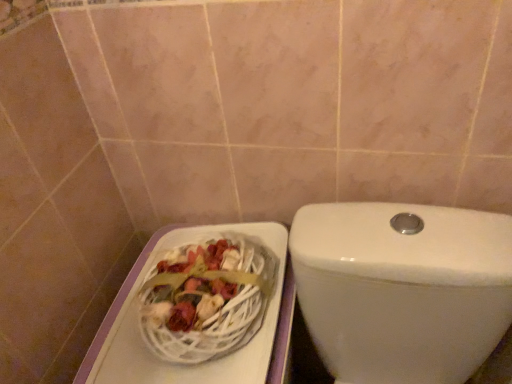
Identify the location of white glossy toilet at center. The image size is (512, 384). (402, 289).

Describe the element at coordinates (402, 289) in the screenshot. This screenshot has height=384, width=512. I see `white glossy toilet at center` at that location.

In order to click on white wicker basket at lower left in this screenshot , I will do `click(206, 298)`.

What do you see at coordinates (206, 298) in the screenshot? This screenshot has width=512, height=384. I see `white wicker basket at lower left` at bounding box center [206, 298].

Find the location of a particular element. This screenshot has width=512, height=384. white glossy toilet at center is located at coordinates (402, 289).

Which is more to the left, white glossy toilet at center or white wicker basket at lower left?

From the viewer's perspective, white wicker basket at lower left appears more on the left side.

In the image, is white glossy toilet at center positioned in front of or behind white wicker basket at lower left?

In the image, white glossy toilet at center appears in front of white wicker basket at lower left.

Is point (474, 370) positioned before point (244, 286)?

No.

From the image's perspective, between white glossy toilet at center and white wicker basket at lower left, who is located below?

white glossy toilet at center is shown below in the image.

From a real-world perspective, is white glossy toilet at center positioned over white wicker basket at lower left based on gravity?

No, from a real-world perspective, white glossy toilet at center is not on top of white wicker basket at lower left.

Is white glossy toilet at center wider than white wicker basket at lower left?

Correct, the width of white glossy toilet at center exceeds that of white wicker basket at lower left.

Considering the sizes of objects white glossy toilet at center and white wicker basket at lower left in the image provided, who is shorter, white glossy toilet at center or white wicker basket at lower left?

Standing shorter between the two is white wicker basket at lower left.

From the picture: Looking at the image, does white glossy toilet at center seem bigger or smaller compared to white wicker basket at lower left?

Clearly, white glossy toilet at center is larger in size than white wicker basket at lower left.

Is white glossy toilet at center positioned beyond the bounds of white wicker basket at lower left?

white glossy toilet at center lies outside white wicker basket at lower left's area.

Is the surface of white glossy toilet at center in direct contact with white wicker basket at lower left?

white glossy toilet at center and white wicker basket at lower left are not in contact.

Is white glossy toilet at center looking in the opposite direction of white wicker basket at lower left?

white glossy toilet at center is not turned away from white wicker basket at lower left.

What are the coordinates of `toilet on the right of white wicker basket at lower left` in the screenshot? It's located at (402, 289).

Is white wicker basket at lower left to the right of white glossy toilet at center from the viewer's perspective?

No, white wicker basket at lower left is not to the right of white glossy toilet at center.

Considering the relative positions of white wicker basket at lower left and white glossy toilet at center in the image provided, is white wicker basket at lower left behind white glossy toilet at center?

Yes, it is.

Is point (217, 244) in front of point (334, 218)?

That is False.

From the image's perspective, is white wicker basket at lower left on top of white glossy toilet at center?

Yes.

From a real-world perspective, is white wicker basket at lower left located higher than white glossy toilet at center?

Yes.

In terms of width, does white wicker basket at lower left look wider or thinner when compared to white glossy toilet at center?

Clearly, white wicker basket at lower left has less width compared to white glossy toilet at center.

Considering the relative sizes of white wicker basket at lower left and white glossy toilet at center in the image provided, is white wicker basket at lower left shorter than white glossy toilet at center?

Indeed, white wicker basket at lower left has a lesser height compared to white glossy toilet at center.

Does white wicker basket at lower left have a smaller size compared to white glossy toilet at center?

Correct, white wicker basket at lower left occupies less space than white glossy toilet at center.

Is white glossy toilet at center a part of white wicker basket at lower left?

No, white glossy toilet at center is not inside white wicker basket at lower left.

Is white wicker basket at lower left touching white glossy toilet at center?

No, white wicker basket at lower left is not touching white glossy toilet at center.

Consider the image. Is white wicker basket at lower left positioned with its back to white glossy toilet at center?

No.

From the picture: Can you tell me how much white wicker basket at lower left and white glossy toilet at center differ in facing direction?

white wicker basket at lower left and white glossy toilet at center are facing 0.236 degrees away from each other.

Where is `basket located on the left of white glossy toilet at center`? The image size is (512, 384). basket located on the left of white glossy toilet at center is located at coordinates (206, 298).

What are the coordinates of `basket lying on the left of white glossy toilet at center` in the screenshot? It's located at (206, 298).

You are a GUI agent. You are given a task and a screenshot of the screen. Output one action in this format:
    pyautogui.click(x=<x>, y=<y>)
    Task: Click on the toilet below the white wicker basket at lower left (from a real-world perspective)
    This screenshot has height=384, width=512.
    Given the screenshot: What is the action you would take?
    coord(402,289)